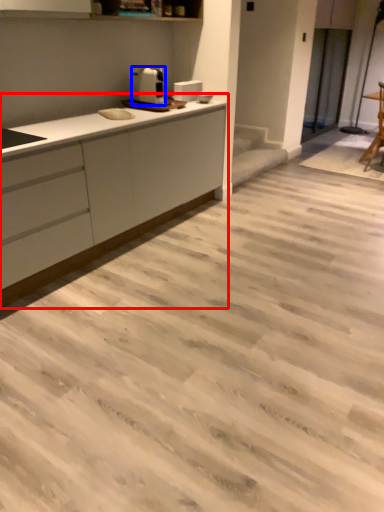
Question: Which object is further to the camera taking this photo, countertop (highlighted by a red box) or home appliance (highlighted by a blue box)?

Choices:
 (A) countertop
 (B) home appliance

Answer: (B)